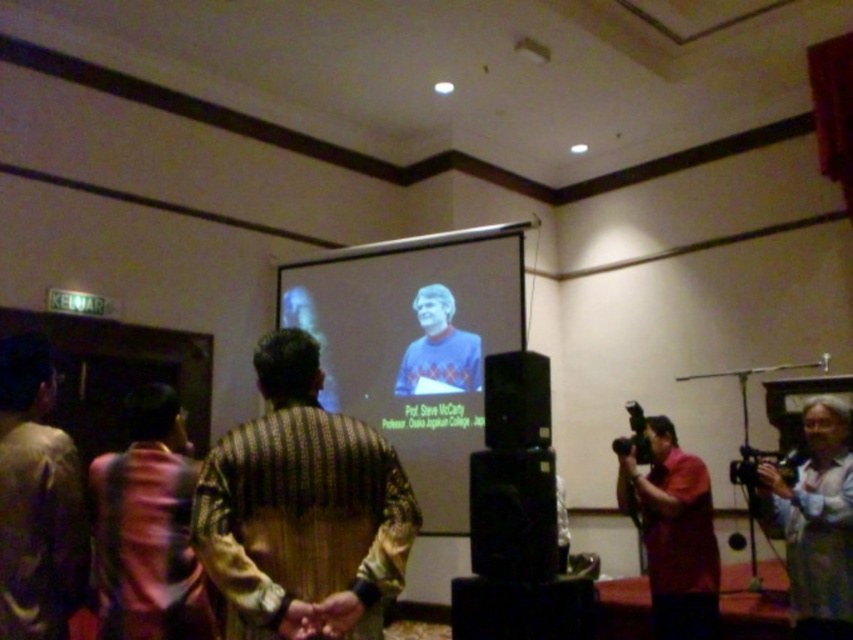
From the picture: You are an attendee in the conference room and want to get a better view of the projector screen. Since you can only move forward or backward, which direction should you go relative to the brown textured shirt at lower left and the light blue shirt at center?

The brown textured shirt at lower left is in front of the light blue shirt at center. To get a better view of the projector screen, you should move backward away from the screen, as the brown textured shirt at lower left is blocking your view if you are behind it. Alternatively, moving forward past the brown textured shirt at lower left might also improve your view if there is space.

You are standing in the conference room and want to greet the person wearing the brown textured shirt at lower left. According to the image, where should you look to find them?

The brown textured shirt at lower left is located at the 2D coordinates point [148,528] in the image, so you should look towards the lower left area of the scene to find them.